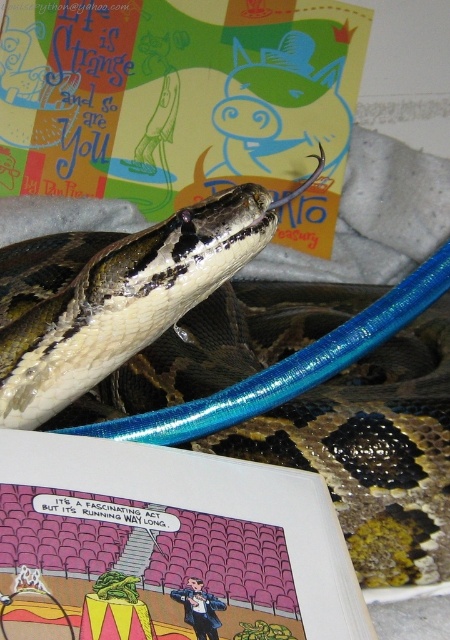
Who is more forward, (67, 273) or (243, 72)?

Point (67, 273) is more forward.

Can you confirm if shiny brown snake at center is bigger than matte paper comic book at upper center?

Yes.

Does point (361, 488) come in front of point (133, 26)?

Yes, point (361, 488) is in front of point (133, 26).

The width and height of the screenshot is (450, 640). I want to click on shiny brown snake at center, so click(309, 404).

Does shiny brown snake at center have a lesser width compared to comic book paper at upper center?

No.

Is shiny brown snake at center to the left of comic book paper at upper center from the viewer's perspective?

In fact, shiny brown snake at center is to the right of comic book paper at upper center.

Does point (448, 269) lie in front of point (9, 451)?

No, it is not.

This screenshot has height=640, width=450. Identify the location of shiny brown snake at center. (309, 404).

Which is behind, point (98, 164) or point (122, 586)?

Point (98, 164)

This screenshot has width=450, height=640. Identify the location of matte paper comic book at upper center. (180, 100).

From the picture: Who is more distant from viewer, (x=13, y=13) or (x=37, y=524)?

The point (x=13, y=13) is behind.

This screenshot has height=640, width=450. In order to click on matte paper comic book at upper center in this screenshot , I will do `click(180, 100)`.